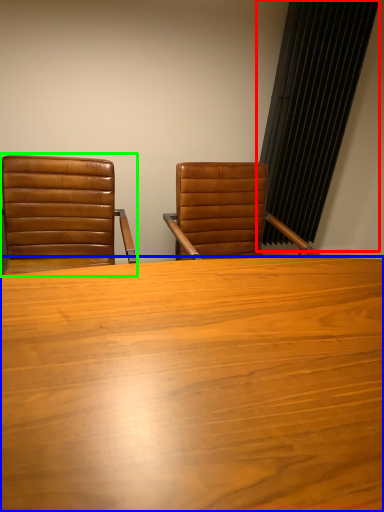
Question: Estimate the real-world distances between objects in this image. Which object is closer to curtain (highlighted by a red box), table (highlighted by a blue box) or chair (highlighted by a green box)?

Choices:
 (A) table
 (B) chair

Answer: (B)